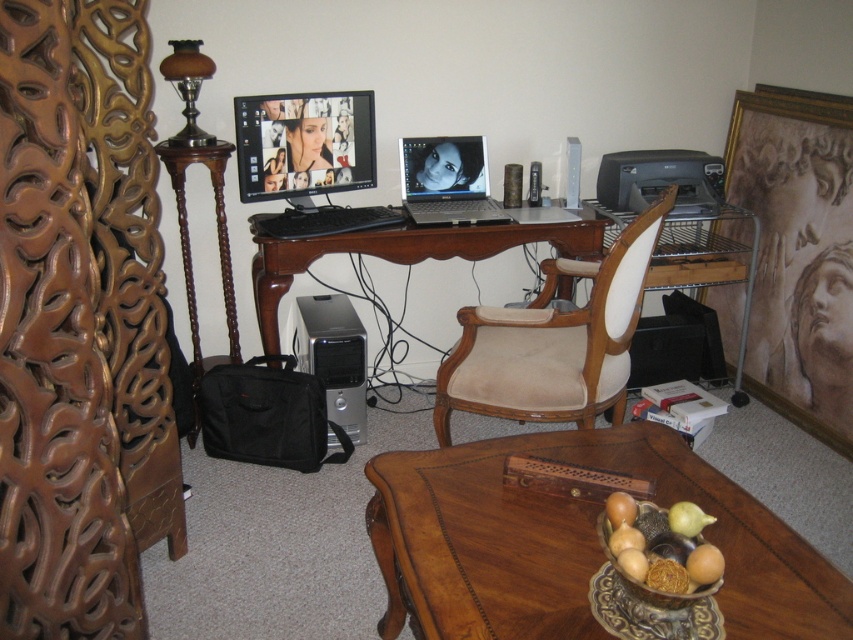
Question: Among these points, which one is farthest from the camera?

Choices:
 (A) (630, 157)
 (B) (189, 435)

Answer: (A)

Question: Is matte plastic monitor at center above matte silver laptop at center?

Choices:
 (A) yes
 (B) no

Answer: (A)

Question: Does beige fabric swivel chair at center appear on the right side of silver/black desktop computer at lower left?

Choices:
 (A) yes
 (B) no

Answer: (A)

Question: Can you confirm if brown wood desk at center is wider than black plastic printer at upper right?

Choices:
 (A) yes
 (B) no

Answer: (A)

Question: Which of the following is the farthest from the observer?

Choices:
 (A) (223, 141)
 (B) (309, 147)

Answer: (B)

Question: Considering the real-world distances, which object is closest to the brown wood computer desk at center?

Choices:
 (A) mahogany wood coffee table at center
 (B) brown wood side table at left
 (C) beige fabric swivel chair at center
 (D) matte silver laptop at center

Answer: (D)